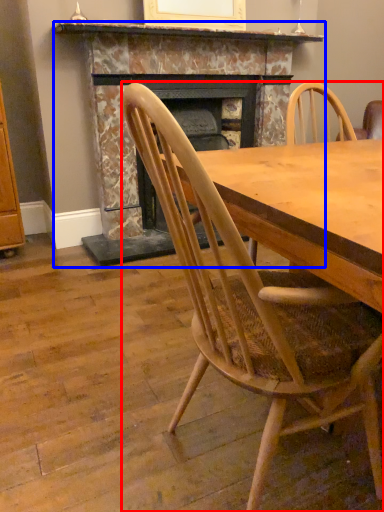
Question: Which point is closer to the camera, chair (highlighted by a red box) or fireplace (highlighted by a blue box)?

Choices:
 (A) chair
 (B) fireplace

Answer: (A)